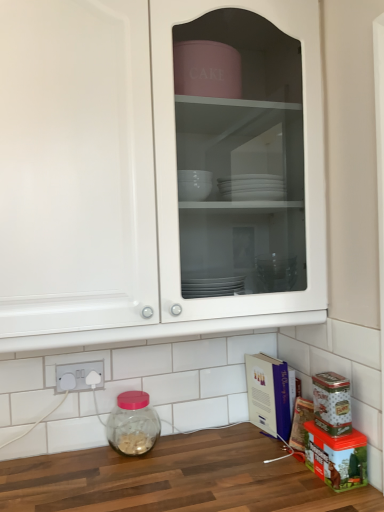
Question: From a real-world perspective, does white glossy cabinet at upper center stand above cardboard box at lower right?

Choices:
 (A) yes
 (B) no

Answer: (A)

Question: Considering the relative positions of white glossy cabinet at upper center and cardboard box at lower right in the image provided, is white glossy cabinet at upper center behind cardboard box at lower right?

Choices:
 (A) yes
 (B) no

Answer: (B)

Question: Considering the relative sizes of white glossy cabinet at upper center and cardboard box at lower right in the image provided, is white glossy cabinet at upper center smaller than cardboard box at lower right?

Choices:
 (A) no
 (B) yes

Answer: (A)

Question: From the image's perspective, would you say white glossy cabinet at upper center is positioned over cardboard box at lower right?

Choices:
 (A) yes
 (B) no

Answer: (A)

Question: Can you confirm if white glossy cabinet at upper center is wider than cardboard box at lower right?

Choices:
 (A) no
 (B) yes

Answer: (B)

Question: Is white glossy cabinet at upper center far from cardboard box at lower right?

Choices:
 (A) yes
 (B) no

Answer: (B)

Question: Is white plastic electric outlet at lower left positioned before transparent glass jar at lower left?

Choices:
 (A) yes
 (B) no

Answer: (B)

Question: Is white plastic electric outlet at lower left with transparent glass jar at lower left?

Choices:
 (A) no
 (B) yes

Answer: (A)

Question: Considering the relative sizes of white plastic electric outlet at lower left and transparent glass jar at lower left in the image provided, is white plastic electric outlet at lower left taller than transparent glass jar at lower left?

Choices:
 (A) no
 (B) yes

Answer: (A)

Question: Is white plastic electric outlet at lower left looking in the opposite direction of transparent glass jar at lower left?

Choices:
 (A) yes
 (B) no

Answer: (B)

Question: Is white plastic electric outlet at lower left behind transparent glass jar at lower left?

Choices:
 (A) yes
 (B) no

Answer: (A)

Question: Does white plastic electric outlet at lower left contain transparent glass jar at lower left?

Choices:
 (A) no
 (B) yes

Answer: (A)

Question: From the image's perspective, does white plastic electric outlet at lower left appear lower than white glossy cabinet at upper center?

Choices:
 (A) yes
 (B) no

Answer: (A)